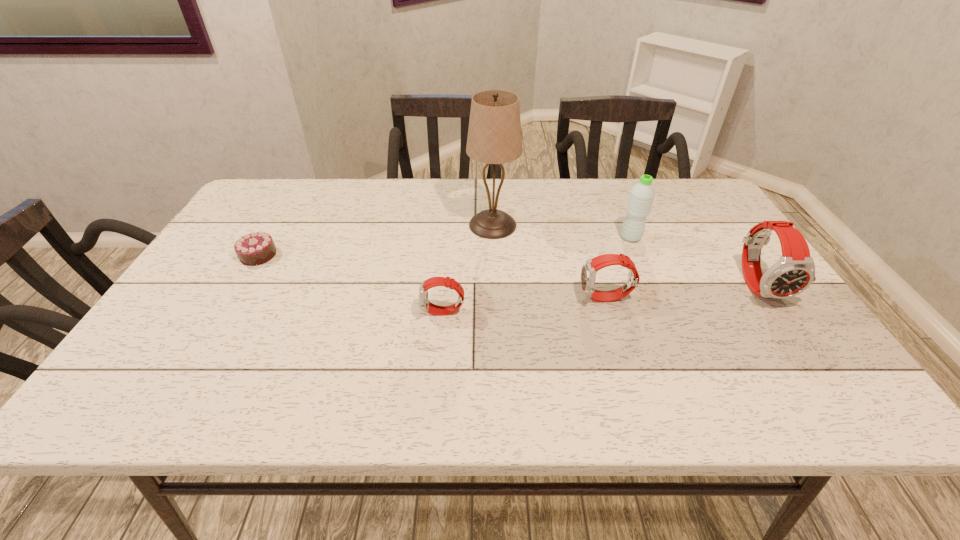
Considering the uniform spacing of watchs, where should an additional watch be positioned on the left? Please locate a free spot. Please provide its 2D coordinates. Your answer should be formatted as a tuple, i.e. [(x, y)], where the tuple contains the x and y coordinates of a point satisfying the conditions above.

[(270, 327)]